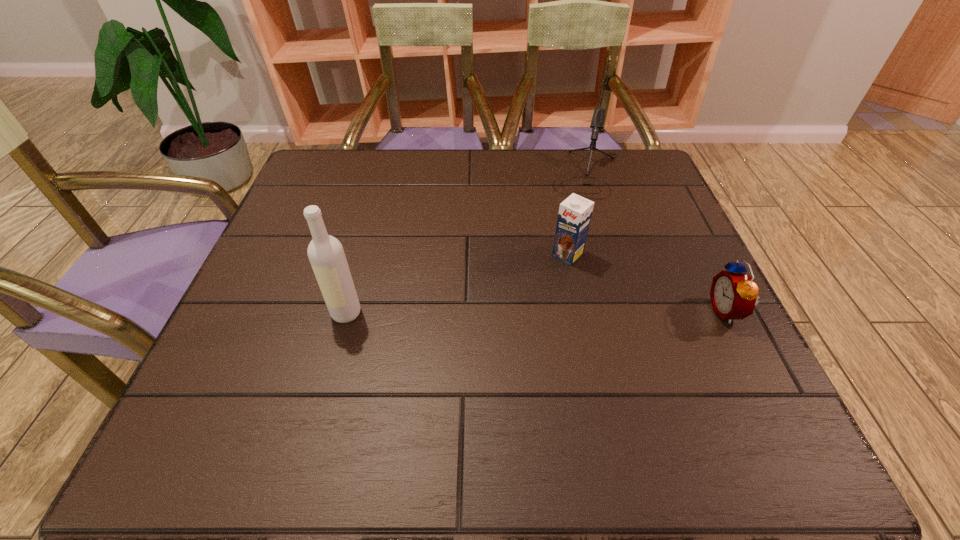
Where is `vodka`? vodka is located at coordinates (326, 254).

This screenshot has height=540, width=960. I want to click on the leftmost object, so click(326, 254).

Locate an element on the screen. alarm clock is located at coordinates (733, 293).

Where is `the farthest object`? The width and height of the screenshot is (960, 540). the farthest object is located at coordinates (597, 122).

Locate an element on the screen. The image size is (960, 540). the second farthest object is located at coordinates (575, 212).

The height and width of the screenshot is (540, 960). I want to click on vacant space situated 0.400m on the back of the leftmost object, so click(380, 187).

This screenshot has width=960, height=540. What are the coordinates of `free space located 0.290m on the front-facing side of the alarm clock` in the screenshot? It's located at (565, 311).

Image resolution: width=960 pixels, height=540 pixels. What are the coordinates of `vacant space located on the front-facing side of the alarm clock` in the screenshot? It's located at (647, 311).

What are the coordinates of `vacant position located on the front-facing side of the alarm clock` in the screenshot? It's located at (596, 311).

Where is `vacant area located on the stand of the microphone`? The width and height of the screenshot is (960, 540). vacant area located on the stand of the microphone is located at coordinates (578, 217).